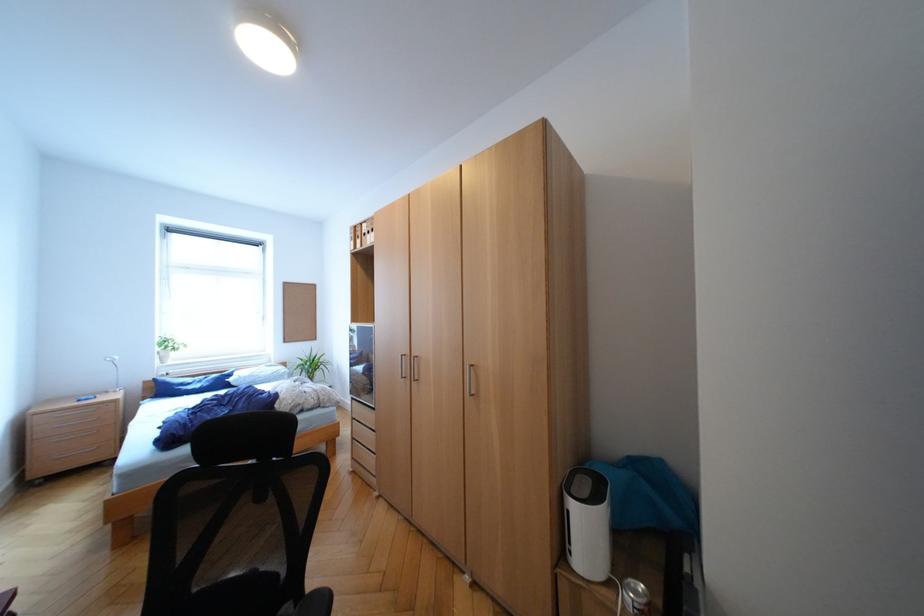
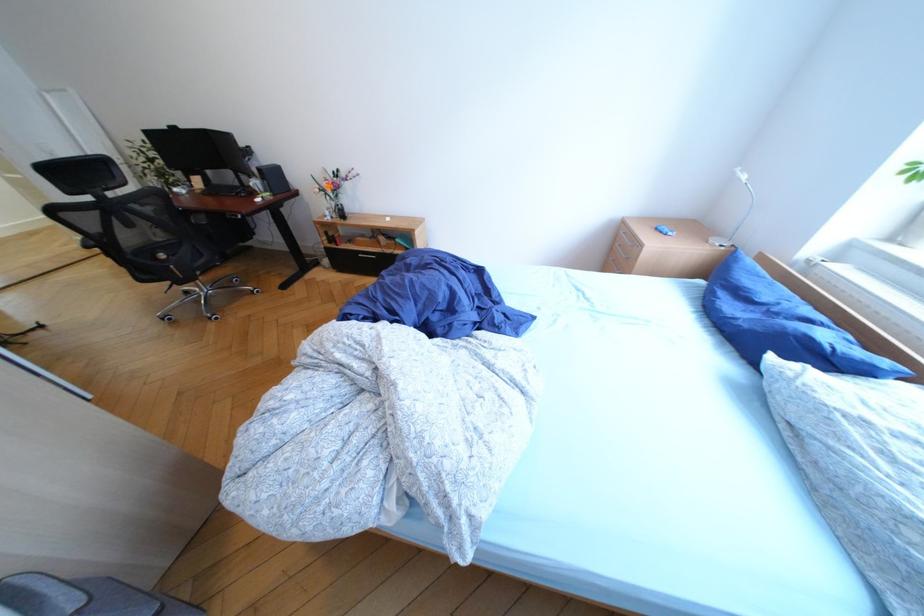
In the second image, find the point that corresponds to point (268, 371) in the first image.

(912, 448)